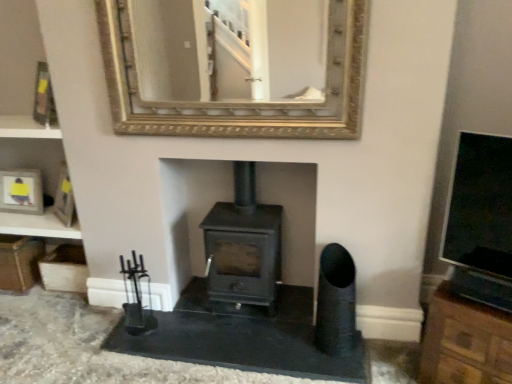
What are the coordinates of `vacant region to the right of black matte wood burning stove at center` in the screenshot? It's located at (294, 310).